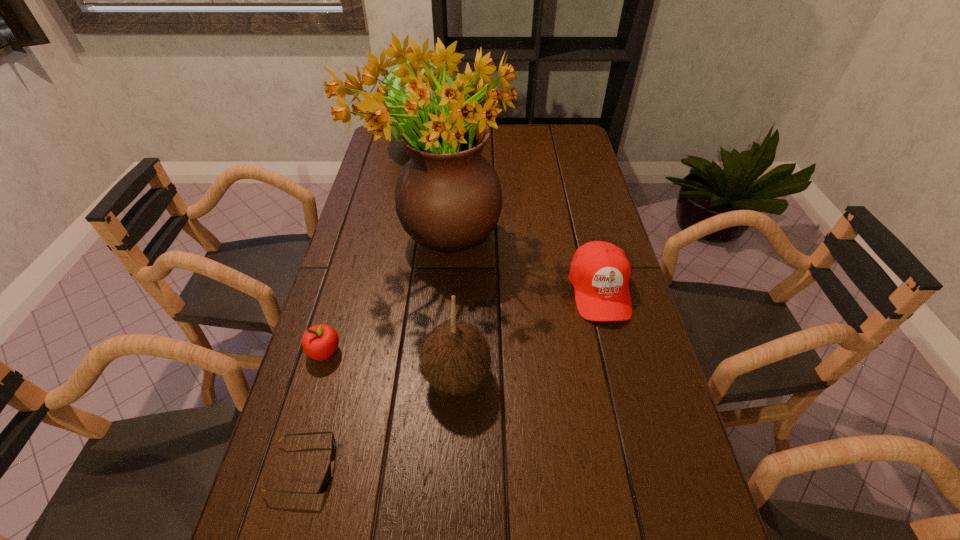
Where is `object that is at the right edge`? The width and height of the screenshot is (960, 540). object that is at the right edge is located at coordinates (600, 271).

At what (x,y) coordinates should I click in order to perform the action: click on object at the far left corner. Please return your answer as a coordinate pair (x, y). The width and height of the screenshot is (960, 540). Looking at the image, I should click on (395, 81).

In order to click on vacant space at the far edge of the desktop in this screenshot , I will do `click(500, 139)`.

In order to click on vacant space at the left edge of the desktop in this screenshot , I will do `click(364, 207)`.

Identify the location of vacant space at the right edge of the desktop. This screenshot has width=960, height=540. (607, 233).

I want to click on vacant region at the far right corner of the desktop, so click(x=553, y=146).

In order to click on vacant space that is in between the fourth shortest object and the flower arrangement in this screenshot , I will do `click(447, 308)`.

At what (x,y) coordinates should I click in order to perform the action: click on vacant region between the fifth tallest object and the farthest object. Please return your answer as a coordinate pair (x, y). Looking at the image, I should click on (375, 248).

Identify the location of free space between the nearest object and the watermelon. The image size is (960, 540). (365, 306).

I want to click on free spot between the fourth shortest object and the nearest object, so click(380, 423).